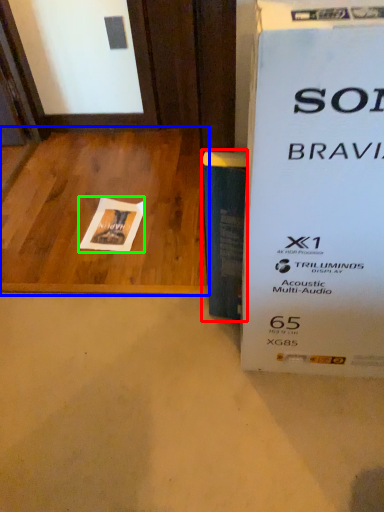
Question: Which object is positioned farthest from paperback book (highlighted by a red box)? Select from table (highlighted by a blue box) and flyer (highlighted by a green box).

Choices:
 (A) table
 (B) flyer

Answer: (A)